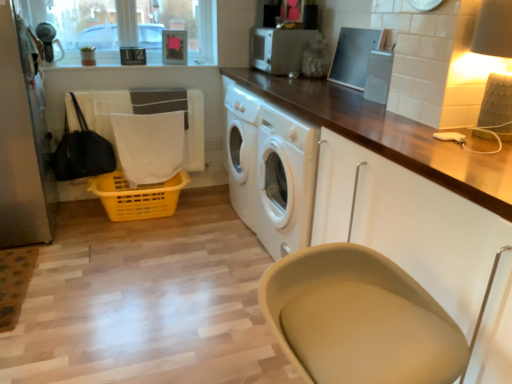
Identify the location of vacant region in front of yellow plastic basket at lower left. (126, 253).